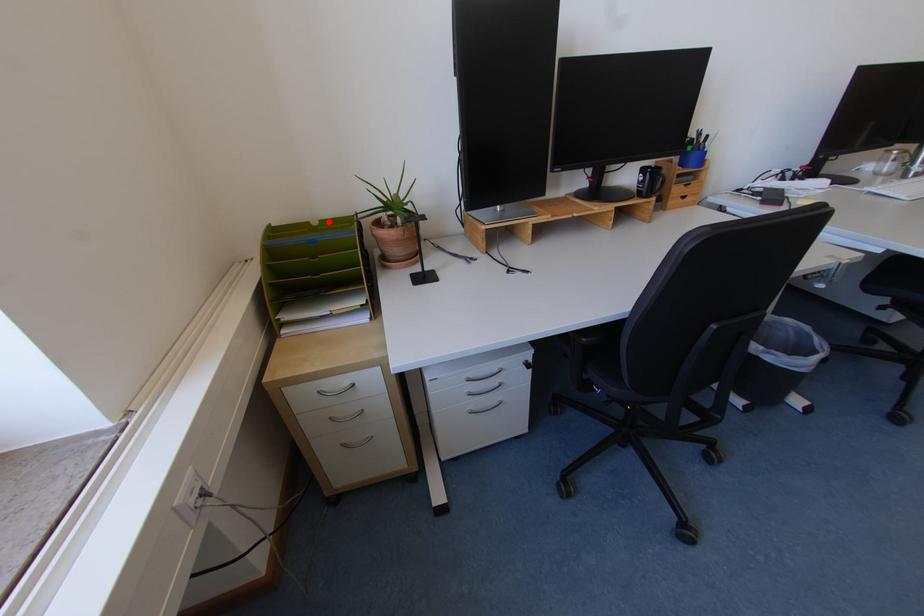
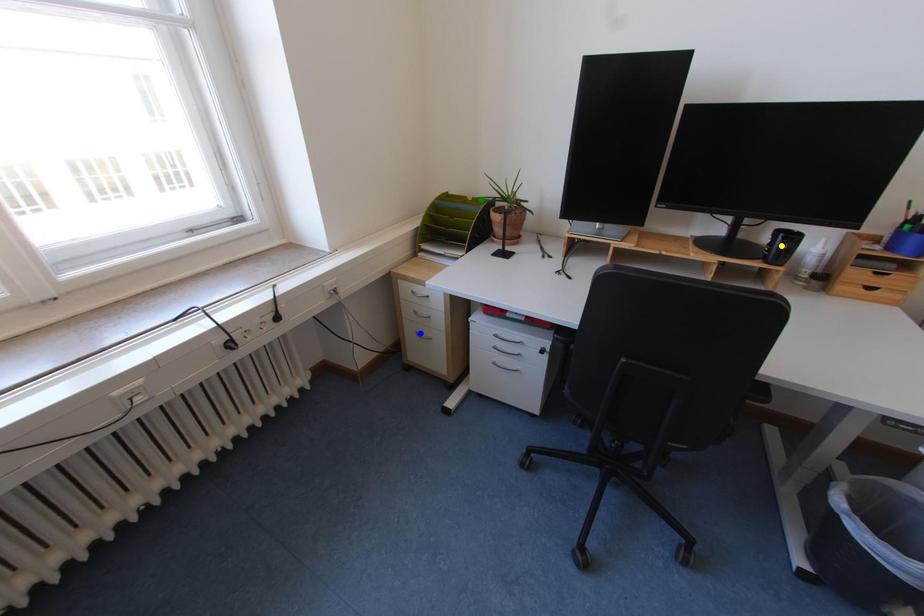
Question: I am providing you with two images of the same scene from different viewpoints. A red point is marked on the first image. You are given multiple points on the second image. Which point in image 2 is actually the same real-world point as the red point in image 1?

Choices:
 (A) blue point
 (B) yellow point
 (C) green point

Answer: (C)